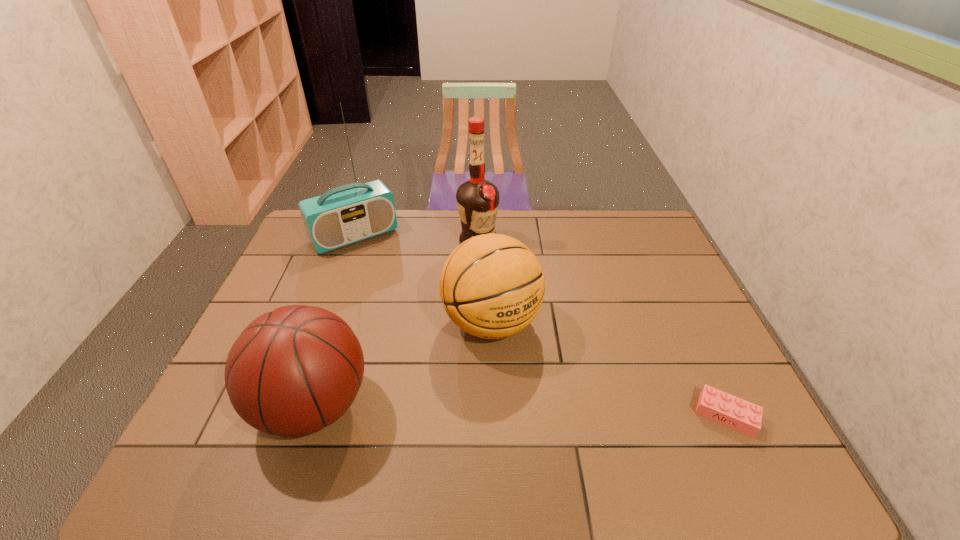
The height and width of the screenshot is (540, 960). Find the location of `vacant position located 0.330m on the front and back of the liquor`. vacant position located 0.330m on the front and back of the liquor is located at coordinates (522, 321).

The image size is (960, 540). What are the coordinates of `vacant space located on the front panel of the radio receiver` in the screenshot? It's located at (401, 294).

Locate an element on the screen. The height and width of the screenshot is (540, 960). vacant area located 0.120m on the front panel of the radio receiver is located at coordinates (385, 273).

Identify the location of blank space located 0.250m on the front panel of the radio receiver. (402, 296).

The image size is (960, 540). In order to click on blank area located 0.110m on the surface of the right basketball near the brand logo in this screenshot , I will do `click(542, 387)`.

Image resolution: width=960 pixels, height=540 pixels. What are the coordinates of `free location located on the surface of the right basketball near the brand logo` in the screenshot? It's located at (547, 393).

In order to click on vacant region located 0.130m on the surface of the right basketball near the brand logo in this screenshot , I will do `click(547, 393)`.

The width and height of the screenshot is (960, 540). Identify the location of liquor located in the far edge section of the desktop. (477, 200).

This screenshot has width=960, height=540. I want to click on radio receiver situated at the far edge, so click(x=350, y=213).

Identify the location of basketball located at the near edge. (293, 371).